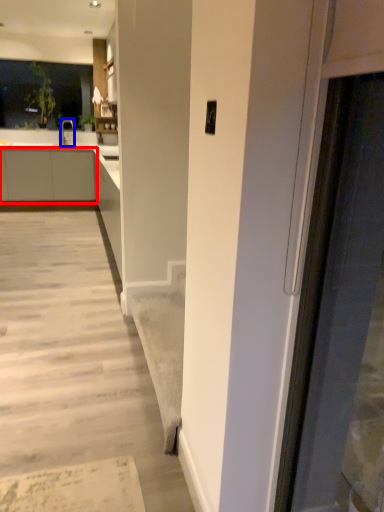
Question: Which object appears closest to the camera in this image, cabinetry (highlighted by a red box) or tap (highlighted by a blue box)?

Choices:
 (A) cabinetry
 (B) tap

Answer: (A)